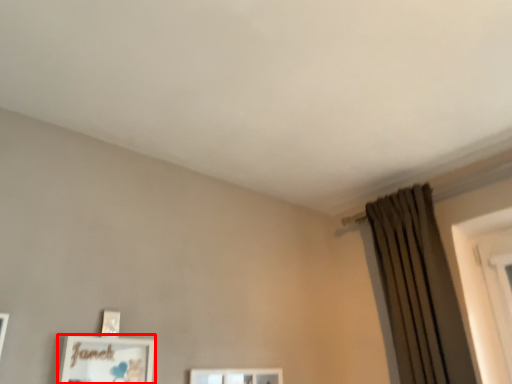
Question: From the image's perspective, where is picture frame (annotated by the red box) located in relation to curtain in the image?

Choices:
 (A) above
 (B) below

Answer: (B)